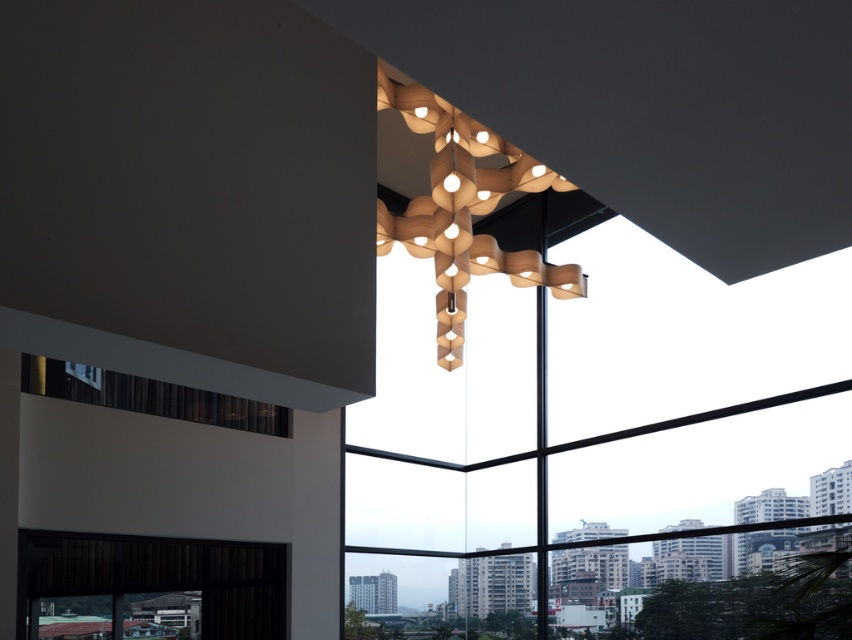
Is wooden chandelier at upper center smaller than black fabric window at lower left?

Incorrect, wooden chandelier at upper center is not smaller in size than black fabric window at lower left.

Between wooden chandelier at upper center and black fabric window at lower left, which one is positioned lower?

black fabric window at lower left

Between point (417, 104) and point (73, 394), which one is positioned behind?

The point (73, 394) is behind.

Where is `wooden chandelier at upper center`? The width and height of the screenshot is (852, 640). wooden chandelier at upper center is located at coordinates (464, 211).